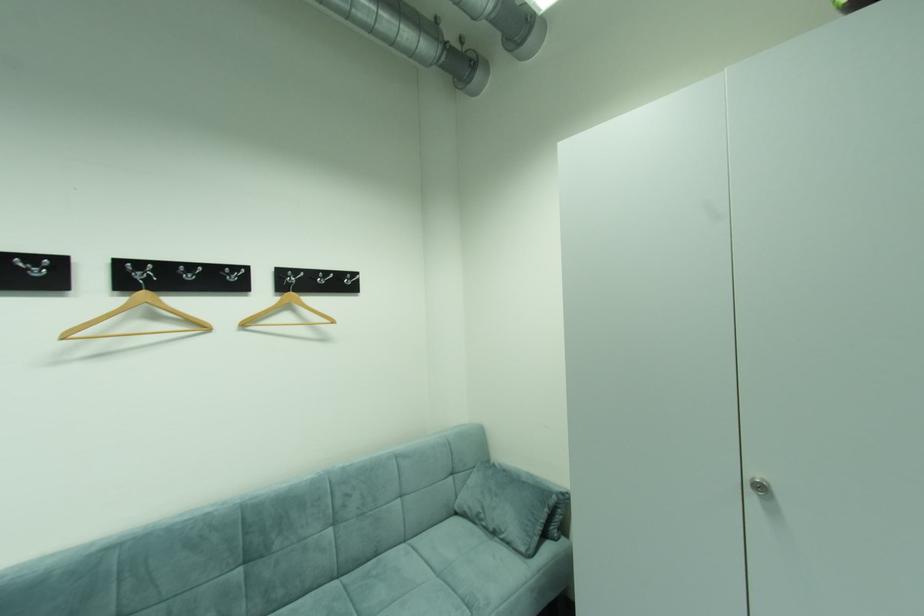
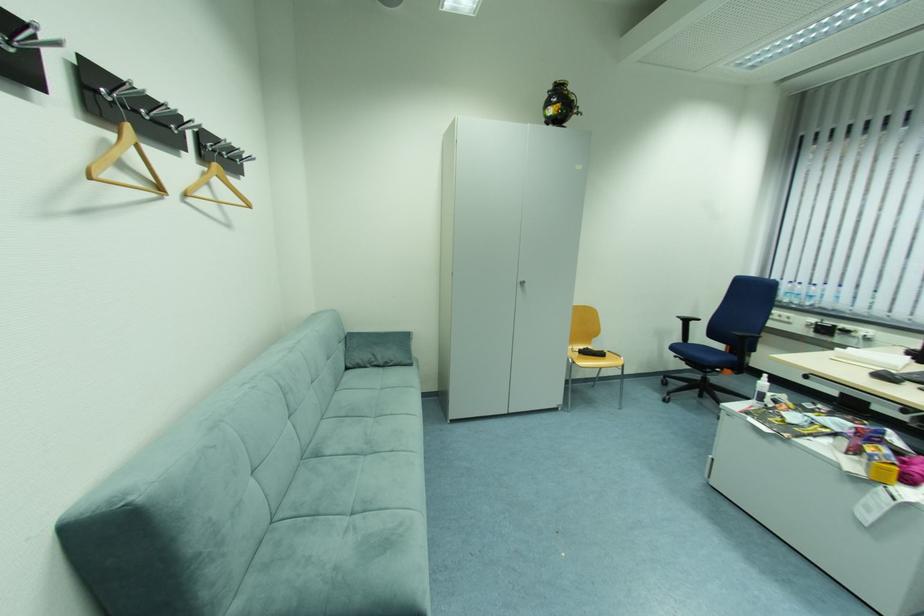
Find the pixel in the second image that matches [762,476] in the first image.

(527, 281)